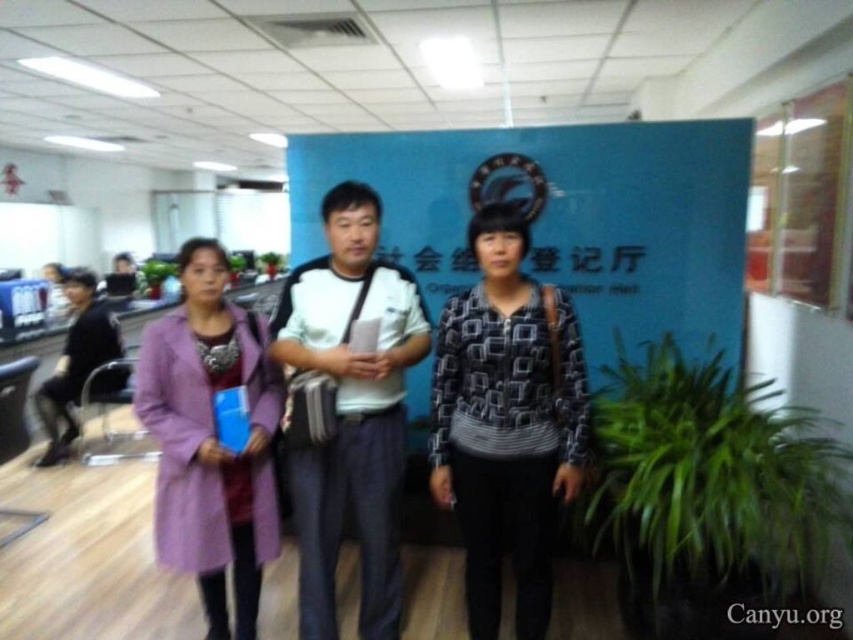
You are a photographer trying to adjust the positions of the two people wearing jackets in the image. The two jackets are the patterned fabric jacket at center and the purple wool coat at center. Which jacket should you move forward so that both jackets appear the same height in the photo?

The patterned fabric jacket at center is taller than the purple wool coat at center. To make them appear the same height, move the purple wool coat at center forward since it is shorter, bringing it closer to the camera and making it visually taller in the photo.

Based on the photo, based on the scene description, where exactly is the patterned fabric jacket at center located in the image?

The patterned fabric jacket at center is located at point coordinates of [508,420].